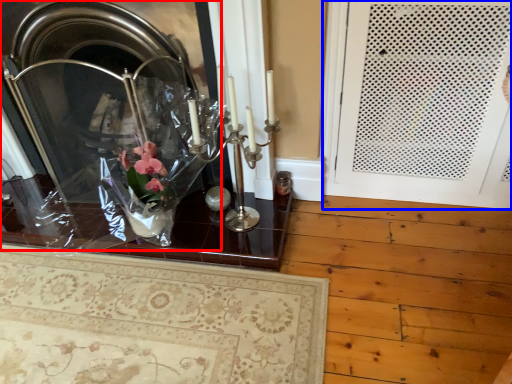
Question: Which of the following is the farthest to the observer, fireplace (highlighted by a red box) or door (highlighted by a blue box)?

Choices:
 (A) fireplace
 (B) door

Answer: (A)